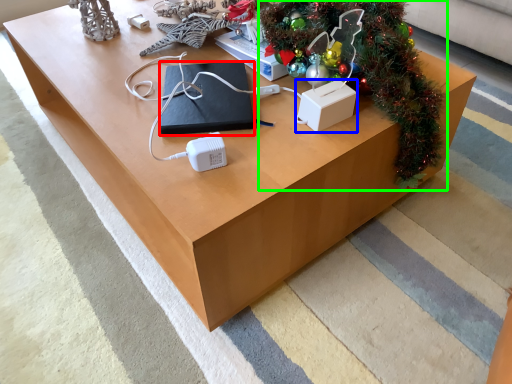
Question: Which object is positioned farthest from pad (highlighted by a red box)? Select from box (highlighted by a blue box) and christmas tree (highlighted by a green box).

Choices:
 (A) box
 (B) christmas tree

Answer: (B)